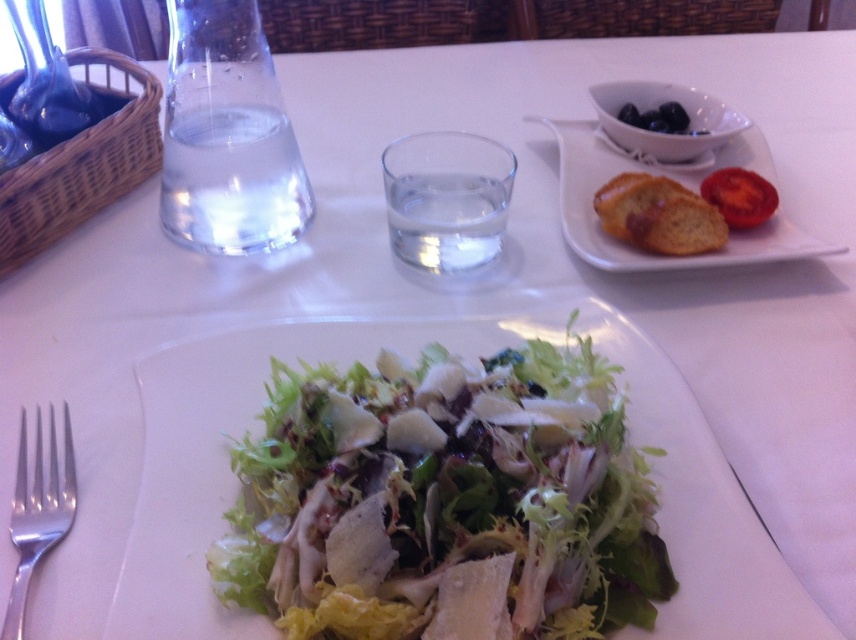
In the scene shown: Who is taller, green leafy salad at center or silver metallic fork at lower left?

green leafy salad at center is taller.

Can you confirm if green leafy salad at center is positioned to the left of silver metallic fork at lower left?

In fact, green leafy salad at center is to the right of silver metallic fork at lower left.

The width and height of the screenshot is (856, 640). What are the coordinates of `green leafy salad at center` in the screenshot? It's located at (444, 497).

Can you confirm if clear glass water at center is positioned to the right of silver metallic fork at lower left?

Indeed, clear glass water at center is positioned on the right side of silver metallic fork at lower left.

Is point (431, 221) behind point (49, 515)?

That is True.

At what (x,y) coordinates should I click in order to perform the action: click on clear glass water at center. Please return your answer as a coordinate pair (x, y). This screenshot has width=856, height=640. Looking at the image, I should click on (444, 218).

Is green leafy salad at center behind golden brown bread at upper right?

No.

Does green leafy salad at center have a greater width compared to golden brown bread at upper right?

Correct, the width of green leafy salad at center exceeds that of golden brown bread at upper right.

Describe the element at coordinates (444, 497) in the screenshot. I see `green leafy salad at center` at that location.

The image size is (856, 640). I want to click on green leafy salad at center, so click(x=444, y=497).